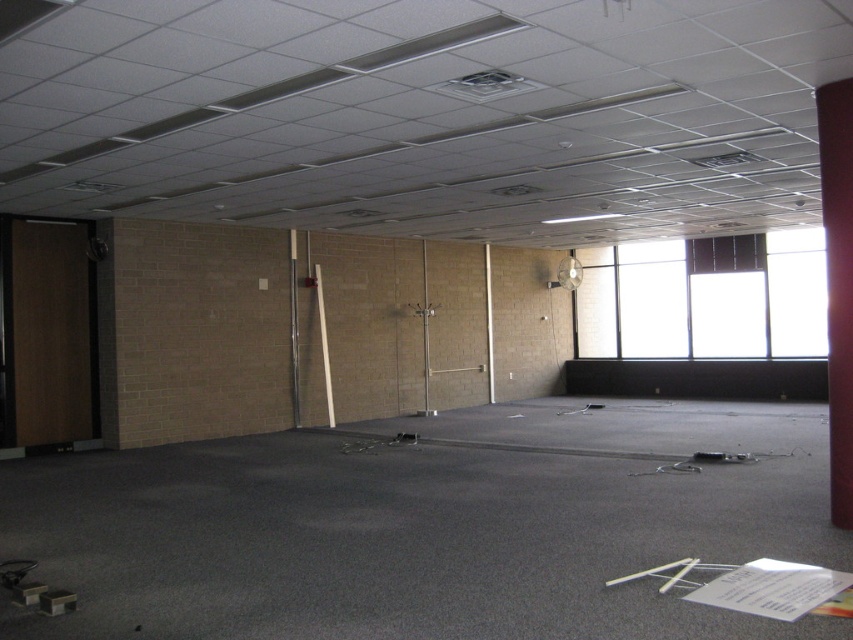
Between transparent glass window at upper right and red matte pillar at right, which one is positioned higher?

transparent glass window at upper right is above.

Between point (814, 296) and point (837, 356), which one is positioned in front?

Point (837, 356)

Which is behind, point (643, 300) or point (846, 307)?

The point (643, 300) is more distant.

Locate an element on the screen. Image resolution: width=853 pixels, height=640 pixels. transparent glass window at upper right is located at coordinates (703, 301).